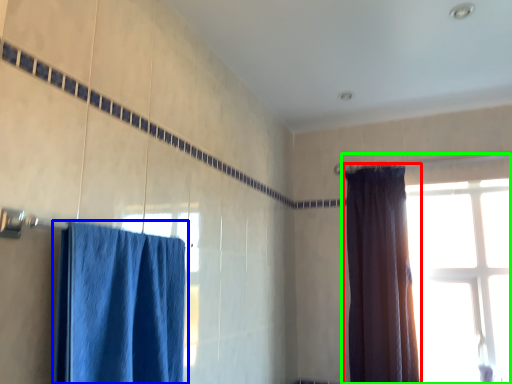
Question: Which object is the closest to the curtain (highlighted by a red box)? Choose among these: curtain (highlighted by a blue box) or window (highlighted by a green box).

Choices:
 (A) curtain
 (B) window

Answer: (B)